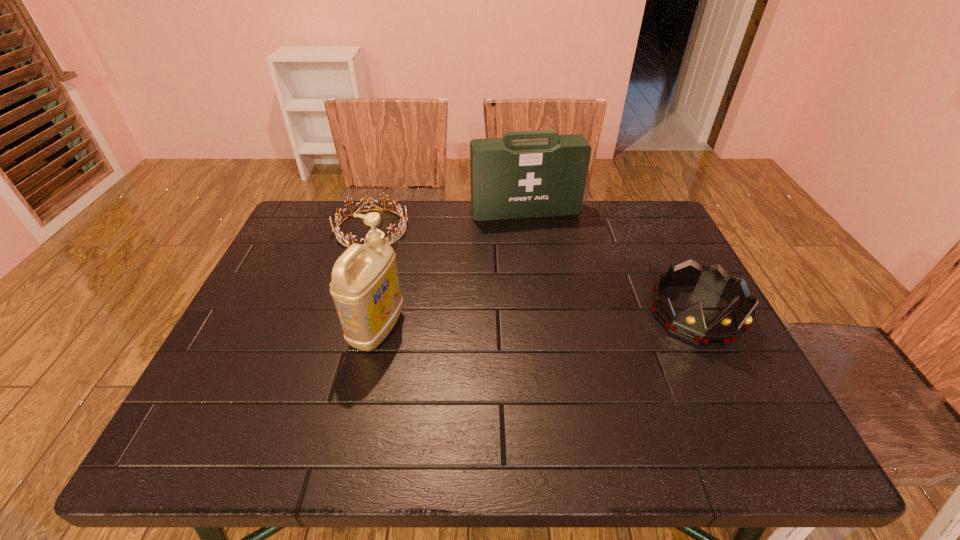
Where is `vacant space at the near edge of the desktop`? The width and height of the screenshot is (960, 540). vacant space at the near edge of the desktop is located at coordinates (646, 382).

This screenshot has width=960, height=540. I want to click on vacant space at the left edge of the desktop, so click(319, 292).

What are the coordinates of `free region at the right edge of the desktop` in the screenshot? It's located at (689, 367).

The width and height of the screenshot is (960, 540). I want to click on vacant region at the far left corner of the desktop, so click(x=345, y=215).

Image resolution: width=960 pixels, height=540 pixels. In order to click on vacant space at the near right corner in this screenshot , I will do pyautogui.click(x=733, y=378).

At what (x,y) coordinates should I click in order to perform the action: click on free spot between the detergent and the second object from right to left. Please return your answer as a coordinate pair (x, y). The height and width of the screenshot is (540, 960). Looking at the image, I should click on (451, 270).

At what (x,y) coordinates should I click in order to perform the action: click on empty space between the shorter tiara and the first-aid kit. Please return your answer as a coordinate pair (x, y). This screenshot has width=960, height=540. Looking at the image, I should click on click(x=448, y=220).

Locate an element on the screen. Image resolution: width=960 pixels, height=540 pixels. vacant space that is in between the first-aid kit and the detergent is located at coordinates (451, 270).

Locate an element on the screen. This screenshot has width=960, height=540. blank region between the detergent and the third object from left to right is located at coordinates (451, 270).

You are a GUI agent. You are given a task and a screenshot of the screen. Output one action in this format:
    pyautogui.click(x=<x>, y=<y>)
    Task: Click on the free point between the taller tiara and the first-aid kit
    The image size is (960, 540).
    Given the screenshot: What is the action you would take?
    pos(611,262)